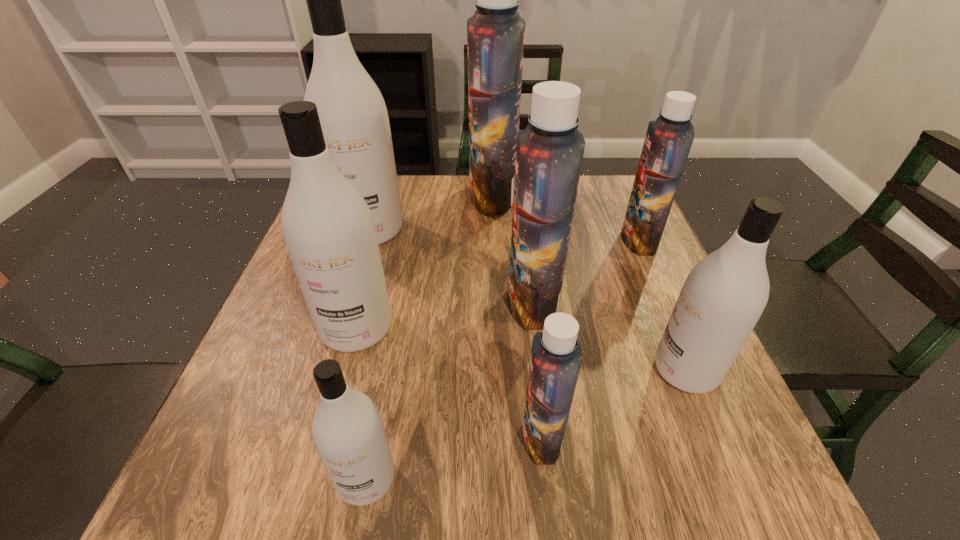
The image size is (960, 540). Find the location of `empty space between the second biggest white shampoo and the rightmost blue shampoo`. empty space between the second biggest white shampoo and the rightmost blue shampoo is located at coordinates (497, 284).

Locate which object ranks in proximity to the nearest blue shampoo. Please provide its 2D coordinates. Your answer should be formatted as a tuple, i.e. [(x, y)], where the tuple contains the x and y coordinates of a point satisfying the conditions above.

[(549, 153)]

Locate which object ranks third in proximity to the farthest blue shampoo. Please provide its 2D coordinates. Your answer should be formatted as a tuple, i.e. [(x, y)], where the tuple contains the x and y coordinates of a point satisfying the conditions above.

[(669, 138)]

Locate which shampoo ranks fourth in proximity to the smallest blue shampoo. Please provide its 2D coordinates. Your answer should be formatted as a tuple, i.e. [(x, y)], where the tuple contains the x and y coordinates of a point satisfying the conditions above.

[(328, 228)]

Locate which shampoo ranks seventh in proximity to the biggest blue shampoo. Please provide its 2D coordinates. Your answer should be formatted as a tuple, i.e. [(x, y)], where the tuple contains the x and y coordinates of a point satisfying the conditions above.

[(347, 429)]

The width and height of the screenshot is (960, 540). In order to click on blue shampoo that is the closest to the farthest blue shampoo in this screenshot , I will do `click(549, 153)`.

Locate an element on the screen. This screenshot has height=540, width=960. blue shampoo that stands as the fourth closest to the third biggest white shampoo is located at coordinates (495, 33).

Locate an element on the screen. white shampoo that is the third closest to the second farthest blue shampoo is located at coordinates (353, 116).

Identify which white shampoo is located as the second nearest to the second nearest blue shampoo. Please provide its 2D coordinates. Your answer should be formatted as a tuple, i.e. [(x, y)], where the tuple contains the x and y coordinates of a point satisfying the conditions above.

[(328, 228)]

Image resolution: width=960 pixels, height=540 pixels. In order to click on free spot that satisfies the following two spatial constraints: 1. on the front-facing side of the third biggest white shampoo; 2. on the front-facing side of the nearest white shampoo in this screenshot , I will do `click(731, 478)`.